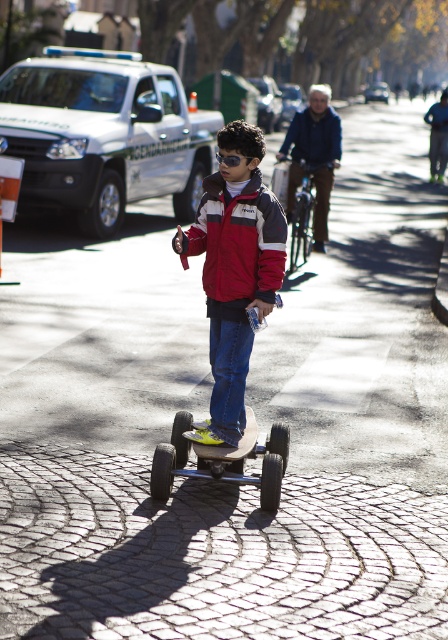
You are a photographer trying to capture the entire scene in one shot. The red matte jacket at center and the metallic silver skateboard at center are both in your frame. Considering their sizes, which object will appear smaller in the photo?

The red matte jacket at center appears smaller in the photo because it occupies less space than the metallic silver skateboard at center.

You are a photographer standing on the sidewalk. You want to take a picture of the red jacket at center and the black rubber skateboard at center. Which object should you focus on first if you want to capture both in the same frame without moving your camera?

The red jacket at center is much taller than the black rubber skateboard at center, so you should focus on the red jacket at center first to ensure it is in the frame before adjusting for the skateboard.